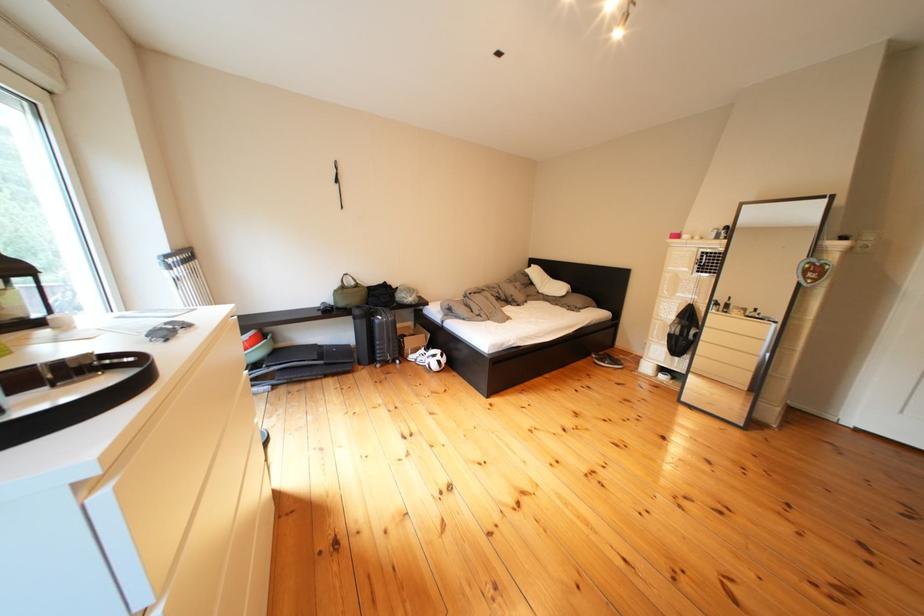
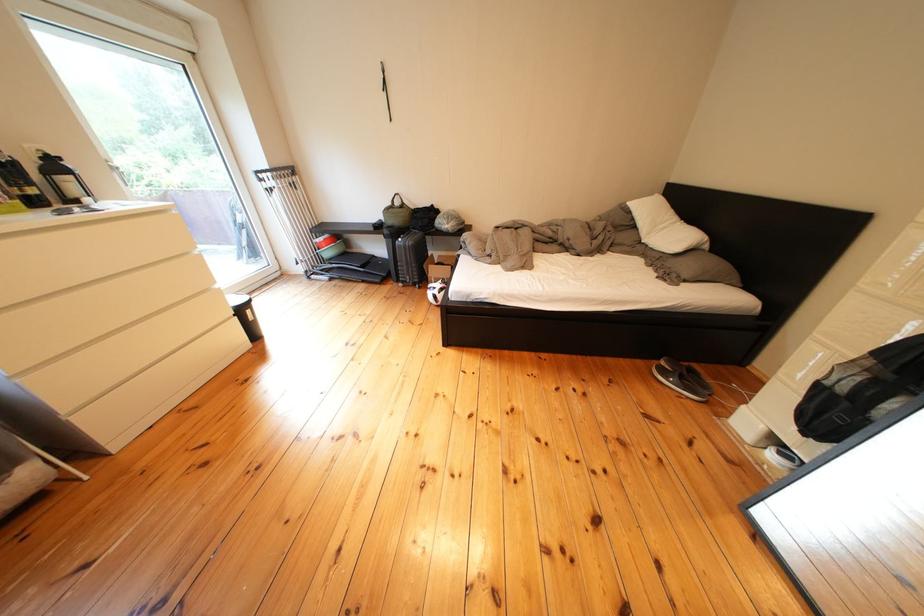
Where in the second image is the point corresponding to [407,366] from the first image?

(429, 290)